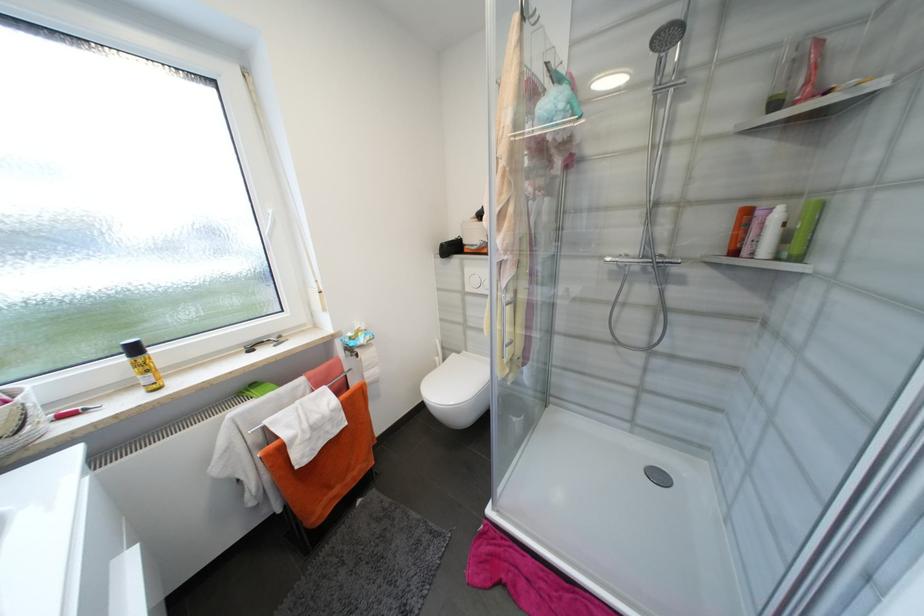
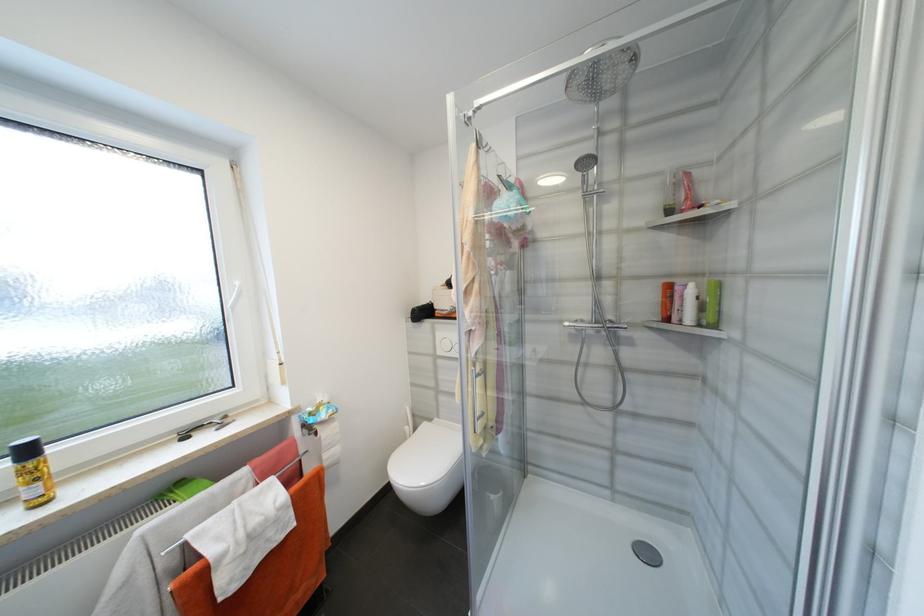
The point at (450, 361) is marked in the first image. Where is the corresponding point in the second image?

(420, 431)